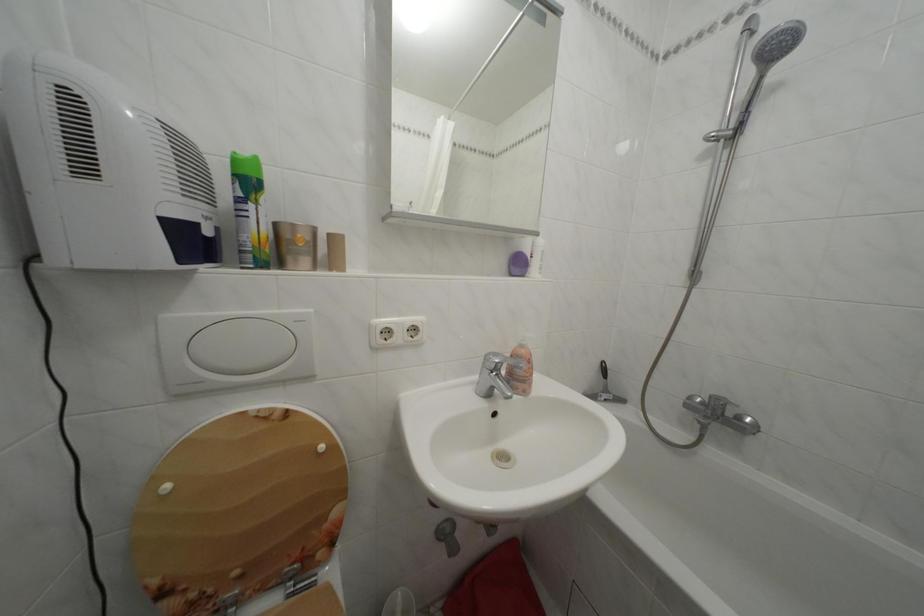
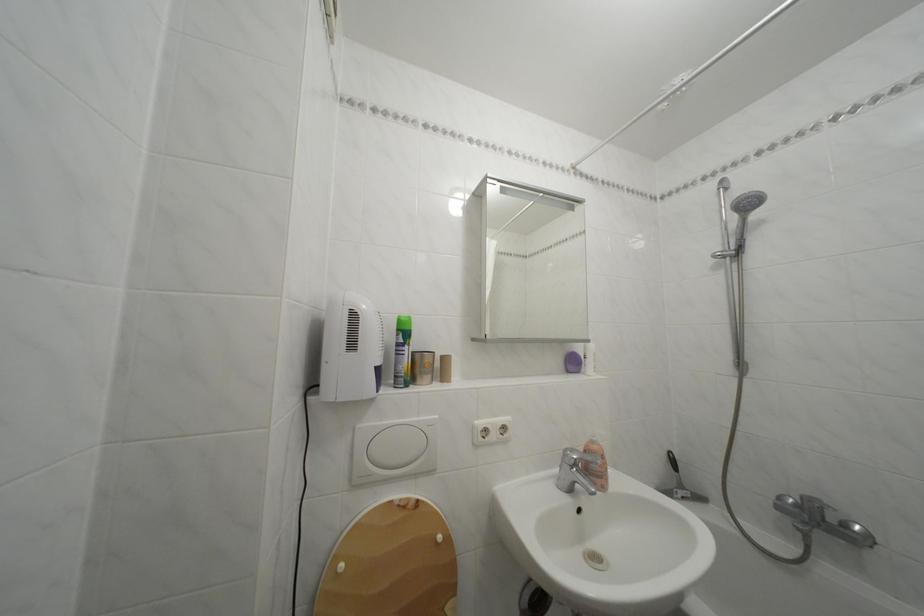
Find the pixel in the second image that matches [711,410] in the first image.

(806, 512)